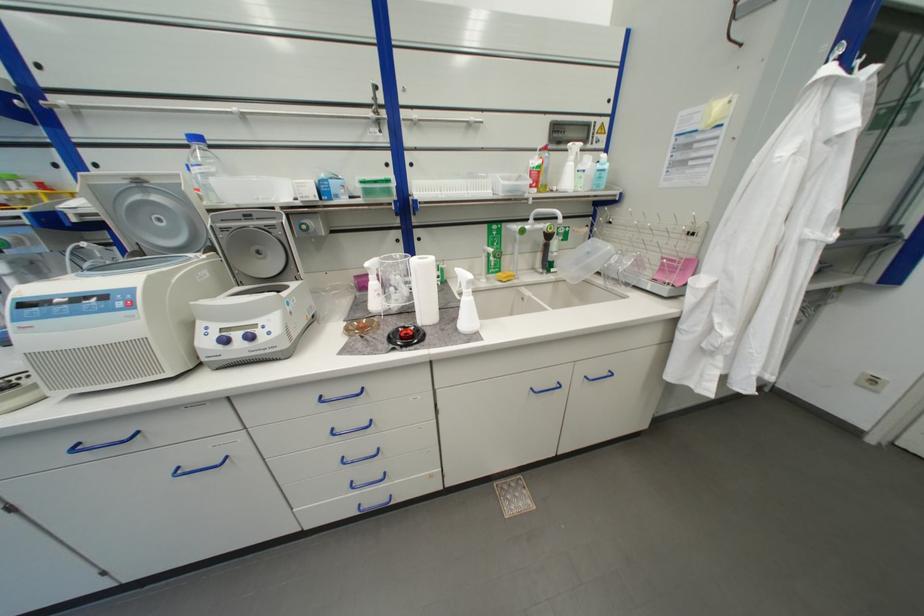
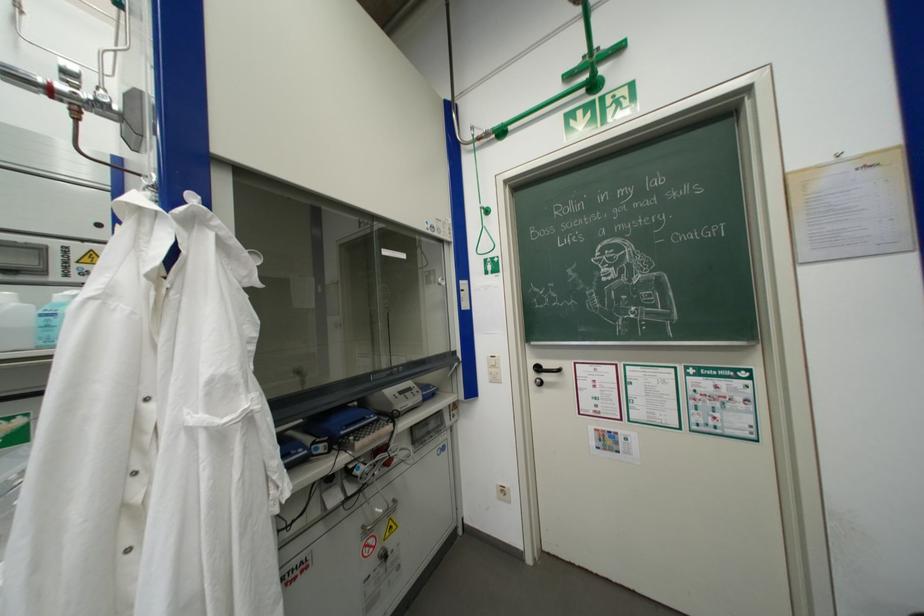
Locate, in the second image, the point that corresponds to the point at 866,386 in the first image.

(506, 500)